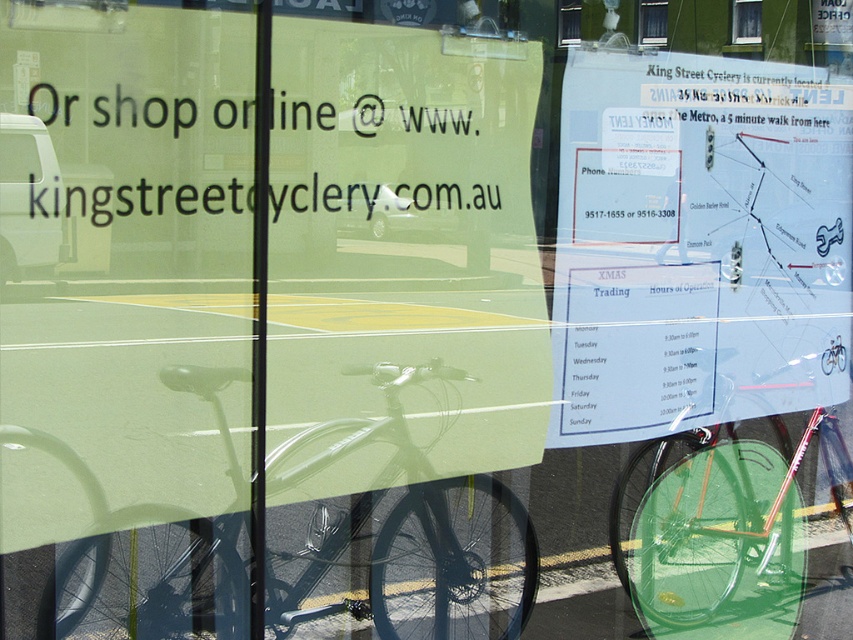
Question: Which point is farther to the camera?

Choices:
 (A) (177, 605)
 (B) (566, 19)

Answer: (B)

Question: Can you confirm if white paper map at upper center is thinner than shiny metallic bicycle at center?

Choices:
 (A) yes
 (B) no

Answer: (A)

Question: Among these points, which one is farthest from the camera?

Choices:
 (A) (566, 32)
 (B) (657, 3)
 (C) (537, 568)

Answer: (C)

Question: Which object is closer to the camera taking this photo?

Choices:
 (A) green matte bicycle at center
 (B) clear glass window at upper center
 (C) transparent glass window at upper center
 (D) white paper map at upper center

Answer: (C)

Question: Considering the relative positions of green glass window at upper center and transparent glass window at upper center in the image provided, where is green glass window at upper center located with respect to transparent glass window at upper center?

Choices:
 (A) above
 (B) below

Answer: (A)

Question: Is the position of green glass window at upper center less distant than that of clear glass window at upper center?

Choices:
 (A) yes
 (B) no

Answer: (B)